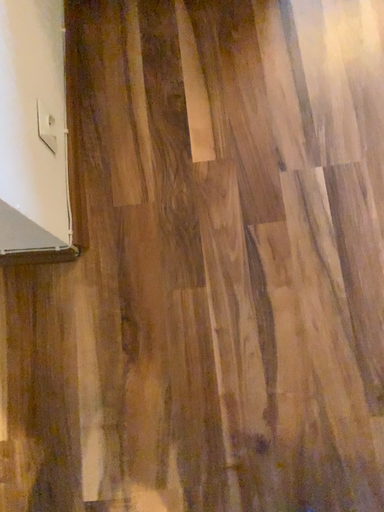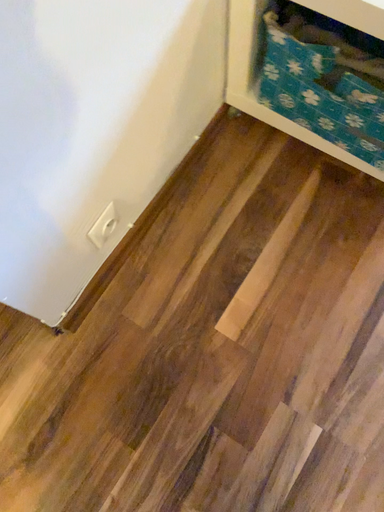
Question: How did the camera likely rotate when shooting the video?

Choices:
 (A) rotated left
 (B) rotated right

Answer: (A)